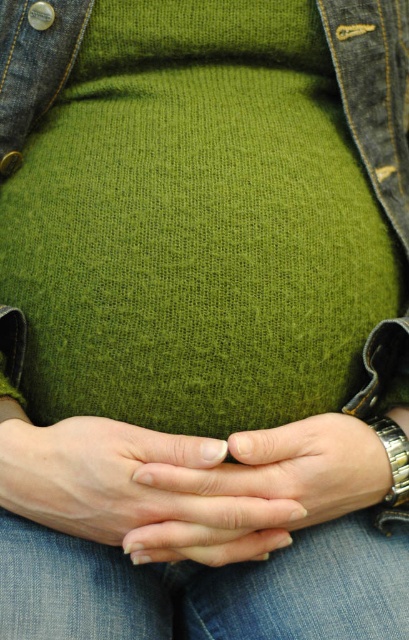
Is blue denim jeans at lower center positioned behind smooth skin hands at center?

No, blue denim jeans at lower center is in front of smooth skin hands at center.

Which is more to the left, blue denim jeans at lower center or smooth skin hands at center?

blue denim jeans at lower center is more to the left.

Is point (289, 582) behind point (314, 481)?

Yes, it is behind point (314, 481).

Find the location of `blue denim jeans at lower center`. blue denim jeans at lower center is located at coordinates (206, 588).

How far apart are matte green sweater at center and smooth skin hands at center?

matte green sweater at center and smooth skin hands at center are 1.38 inches apart.

Who is higher up, matte green sweater at center or smooth skin hands at center?

matte green sweater at center

Identify the location of matte green sweater at center. (132, 492).

In the scene shown: Measure the distance between blue denim jeans at lower center and camera.

The distance of blue denim jeans at lower center from camera is 19.79 inches.

Can you confirm if blue denim jeans at lower center is shorter than matte green sweater at center?

No.

Identify the location of blue denim jeans at lower center. The width and height of the screenshot is (409, 640). (206, 588).